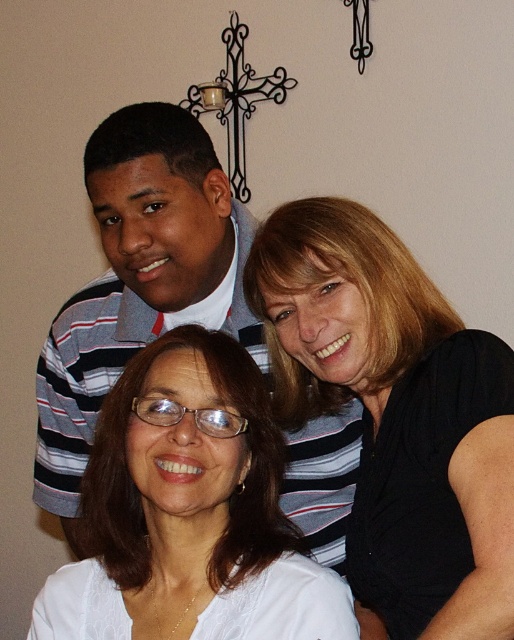
You are a photographer adjusting your camera to focus on the black matte shirt at upper right and the white matte glasses at center. Which object should you focus on first if you want to ensure both are in focus without moving the camera?

The black matte shirt at upper right is closer to the viewer than the white matte glasses at center, so focus on the black matte shirt at upper right first to ensure both are in focus.

You are standing in front of the beige wall with three people in the photo. You need to locate the black matte shirt at upper right. Which point on the wall corresponds to its position? Choose from the given options below. The options are point A at coordinates [394,410] or point B at coordinates 0.358, 0.232.

The black matte shirt at upper right is represented by point A at coordinates [394,410].

You are a photographer trying to adjust the lighting for a photo shoot. You need to place a spotlight at the exact position of the black matte shirt at upper right. What are the coordinates where you should place the spotlight?

The coordinates for the black matte shirt at upper right are at point (394, 410), so you should place the spotlight at those coordinates.